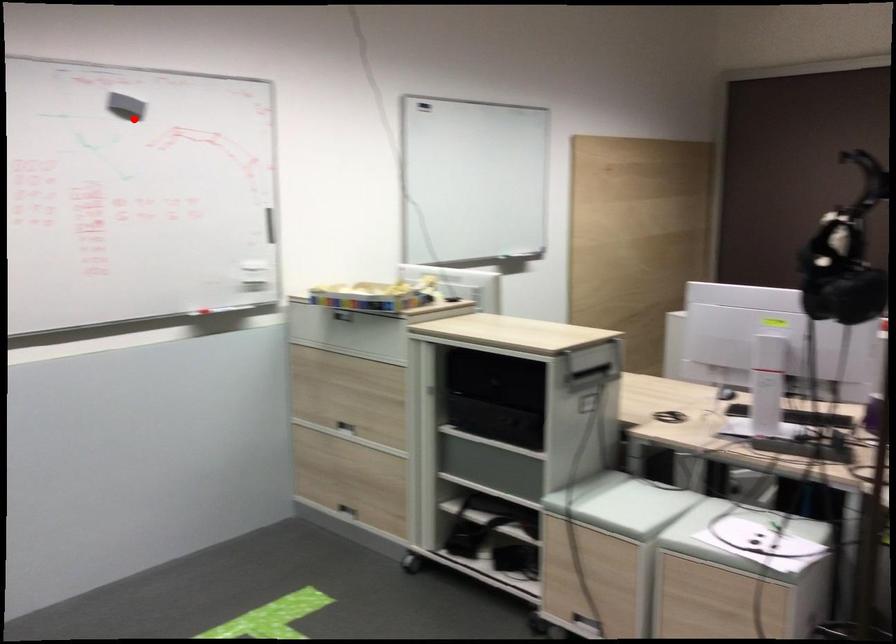
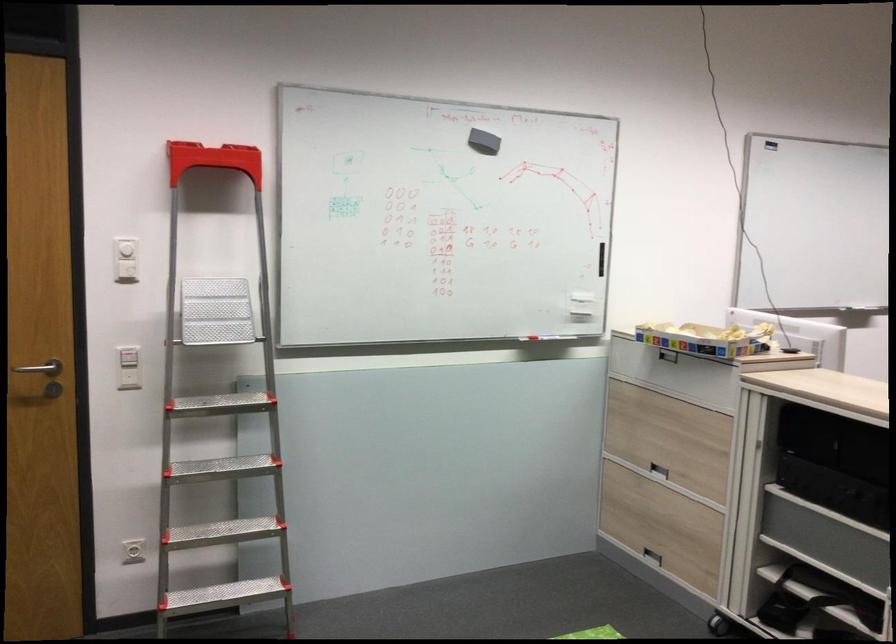
In the second image, find the point that corresponds to the highlighted location in the first image.

(483, 142)